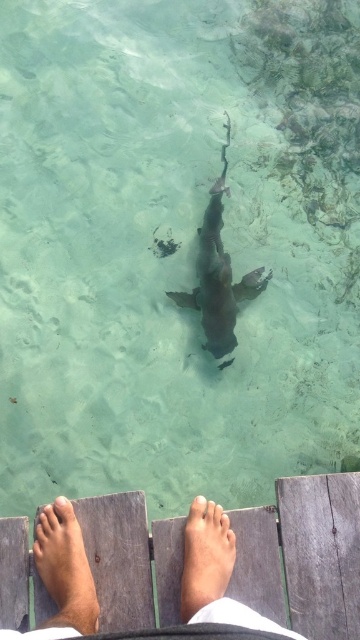
Question: Estimate the real-world distances between objects in this image. Which object is closer to the pale skin toe at lower center?

Choices:
 (A) brown skin foot at lower center
 (B) brown wood foot at lower left
 (C) matte skin toe at lower left

Answer: (A)

Question: Which is farther from the matte skin toe at lower left?

Choices:
 (A) brown skin foot at lower center
 (B) smooth gray shark at center
 (C) pale skin toe at lower center
 (D) brown skin at lower center

Answer: (B)

Question: Among these objects, which one is nearest to the camera?

Choices:
 (A) brown wood foot at lower left
 (B) brown skin foot at lower center
 (C) brown skin at lower center

Answer: (C)

Question: Observing the image, what is the correct spatial positioning of brown skin at lower center in reference to pale skin toe at lower center?

Choices:
 (A) right
 (B) left

Answer: (B)

Question: Is brown skin foot at lower center bigger than pink flesh at center?

Choices:
 (A) yes
 (B) no

Answer: (A)

Question: Can you confirm if brown skin at lower center is smaller than pink flesh at center?

Choices:
 (A) yes
 (B) no

Answer: (B)